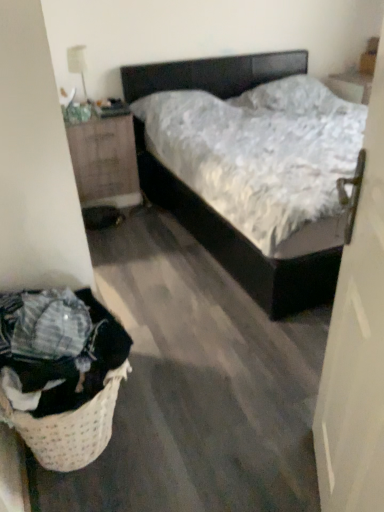
I want to click on free spot to the right of woven beige laundry basket at lower left, so click(x=174, y=424).